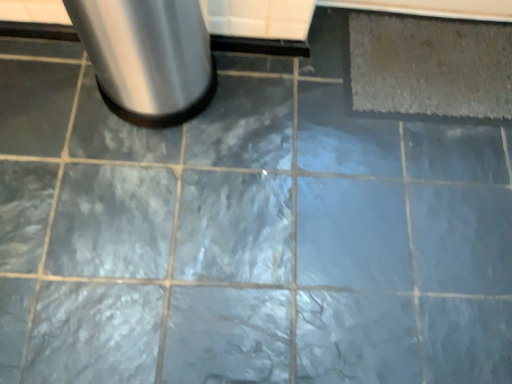
Question: In terms of height, does gray textured mat at upper right look taller or shorter compared to brushed metal trash can at upper left?

Choices:
 (A) short
 (B) tall

Answer: (A)

Question: From a real-world perspective, is gray textured mat at upper right positioned above or below brushed metal trash can at upper left?

Choices:
 (A) above
 (B) below

Answer: (B)

Question: Looking at their shapes, would you say gray textured mat at upper right is wider or thinner than brushed metal trash can at upper left?

Choices:
 (A) wide
 (B) thin

Answer: (A)

Question: Is brushed metal trash can at upper left in front of or behind gray textured mat at upper right in the image?

Choices:
 (A) front
 (B) behind

Answer: (A)

Question: Considering the positions of brushed metal trash can at upper left and gray textured mat at upper right in the image, is brushed metal trash can at upper left bigger or smaller than gray textured mat at upper right?

Choices:
 (A) small
 (B) big

Answer: (B)

Question: From the image's perspective, is brushed metal trash can at upper left positioned above or below gray textured mat at upper right?

Choices:
 (A) below
 (B) above

Answer: (A)

Question: In terms of width, does brushed metal trash can at upper left look wider or thinner when compared to gray textured mat at upper right?

Choices:
 (A) wide
 (B) thin

Answer: (B)